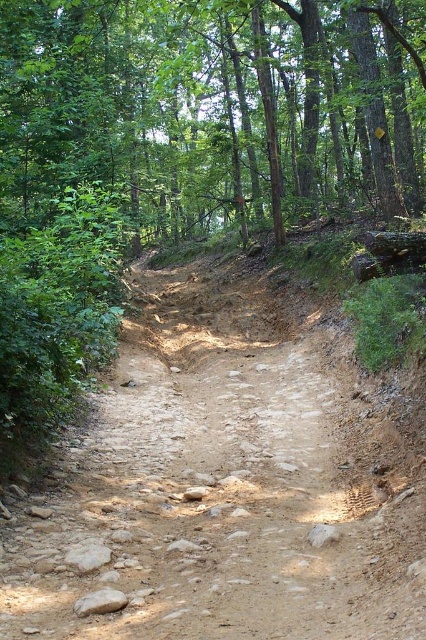
Looking at this image, between green leafy tree at upper center and gray rough rock at center, which one appears on the right side from the viewer's perspective?

From the viewer's perspective, green leafy tree at upper center appears more on the right side.

Does green leafy tree at upper center appear on the left side of gray rough rock at center?

In fact, green leafy tree at upper center is to the right of gray rough rock at center.

Is point (0, 141) positioned after point (89, 612)?

Yes, point (0, 141) is behind point (89, 612).

The image size is (426, 640). I want to click on green leafy tree at upper center, so click(209, 106).

Can you confirm if gray rough rock at center is thinner than gray rough rock at lower left?

Yes.

Where is `gray rough rock at center`? gray rough rock at center is located at coordinates (100, 602).

Which is in front, point (89, 602) or point (109, 548)?

Point (89, 602)

This screenshot has width=426, height=640. What are the coordinates of `gray rough rock at center` in the screenshot? It's located at pyautogui.click(x=100, y=602).

Between brown dirt track at center and green leafy tree at upper center, which one is positioned lower?

brown dirt track at center is lower down.

Does brown dirt track at center have a lesser height compared to green leafy tree at upper center?

Indeed, brown dirt track at center has a lesser height compared to green leafy tree at upper center.

Image resolution: width=426 pixels, height=640 pixels. Identify the location of brown dirt track at center. (229, 481).